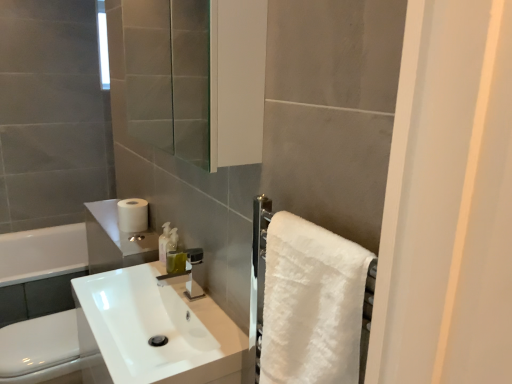
What is the approximate width of translucent plastic soap dispenser at center?

It is 6.31 centimeters.

What do you see at coordinates (41, 349) in the screenshot? This screenshot has width=512, height=384. I see `white glossy toilet bowl at lower left` at bounding box center [41, 349].

The width and height of the screenshot is (512, 384). In order to click on translucent plastic soap dispenser at center in this screenshot , I will do `click(172, 240)`.

Where is `white glossy sink at center`? Image resolution: width=512 pixels, height=384 pixels. white glossy sink at center is located at coordinates (153, 330).

From the image's perspective, does translucent plastic soap dispenser at center appear lower than white glossy toilet bowl at lower left?

Actually, translucent plastic soap dispenser at center appears above white glossy toilet bowl at lower left in the image.

Is translucent plastic soap dispenser at center not close to white glossy toilet bowl at lower left?

No, there isn't a large distance between translucent plastic soap dispenser at center and white glossy toilet bowl at lower left.

Which is behind, point (175, 246) or point (60, 375)?

Point (175, 246)

Does translucent plastic soap dispenser at center have a larger size compared to white glossy toilet bowl at lower left?

No, translucent plastic soap dispenser at center is not bigger than white glossy toilet bowl at lower left.

Is the surface of translucent plastic soap dispenser at center in direct contact with translucent plastic soap dispenser at center?

Yes, translucent plastic soap dispenser at center is in contact with translucent plastic soap dispenser at center.

From the image's perspective, is translucent plastic soap dispenser at center located above or below translucent plastic soap dispenser at center?

Clearly, from the image's perspective, translucent plastic soap dispenser at center is below translucent plastic soap dispenser at center.

Considering the positions of objects translucent plastic soap dispenser at center and translucent plastic soap dispenser at center in the image provided, who is behind, translucent plastic soap dispenser at center or translucent plastic soap dispenser at center?

→ translucent plastic soap dispenser at center is more distant.

Is translucent plastic soap dispenser at center shorter than translucent plastic soap dispenser at center?

Incorrect, the height of translucent plastic soap dispenser at center does not fall short of that of translucent plastic soap dispenser at center.

From a real-world perspective, is white matte toilet paper at upper left physically located above or below translucent plastic soap dispenser at center?

white matte toilet paper at upper left is above translucent plastic soap dispenser at center.

Is white matte toilet paper at upper left taller or shorter than translucent plastic soap dispenser at center?

In the image, white matte toilet paper at upper left appears to be shorter than translucent plastic soap dispenser at center.

Between white matte toilet paper at upper left and translucent plastic soap dispenser at center, which one has smaller size?

Smaller between the two is translucent plastic soap dispenser at center.

Is white matte toilet paper at upper left directly adjacent to translucent plastic soap dispenser at center?

There is a gap between white matte toilet paper at upper left and translucent plastic soap dispenser at center.

Which of these two, white matte toilet paper at upper left or translucent plastic soap dispenser at center, stands shorter?

Standing shorter between the two is white matte toilet paper at upper left.

You are a GUI agent. You are given a task and a screenshot of the screen. Output one action in this format:
    pyautogui.click(x=<x>, y=<y>)
    Task: Click on the toiletry in front of the white matte toilet paper at upper left
    
    Given the screenshot: What is the action you would take?
    tap(164, 241)

Is white matte toilet paper at upper left next to translucent plastic soap dispenser at center and touching it?

No, white matte toilet paper at upper left is not next to translucent plastic soap dispenser at center.

Would you say white glossy toilet bowl at lower left is inside or outside white matte toilet paper at upper left?

white glossy toilet bowl at lower left is not inside white matte toilet paper at upper left, it's outside.

Are white glossy toilet bowl at lower left and white matte toilet paper at upper left beside each other?

white glossy toilet bowl at lower left and white matte toilet paper at upper left are not in contact.

Measure the distance between white glossy toilet bowl at lower left and white matte toilet paper at upper left.

They are 22.18 inches apart.

Does point (62, 374) come in front of point (139, 218)?

Yes, it is.

From a real-world perspective, is translucent plastic soap dispenser at center located beneath translucent plastic soap dispenser at center?

Yes.

Which is closer, (165, 235) or (172, 244)?

The point (172, 244) is in front.

Which is behind, translucent plastic soap dispenser at center or translucent plastic soap dispenser at center?

translucent plastic soap dispenser at center.

Is there a large distance between translucent plastic soap dispenser at center and translucent plastic soap dispenser at center?

They are positioned close to each other.

Is white matte toilet paper at upper left at the back of white glossy sink at center?

No, white matte toilet paper at upper left is not at the back of white glossy sink at center.

Is white glossy sink at center to the left of white matte toilet paper at upper left from the viewer's perspective?

Incorrect, white glossy sink at center is not on the left side of white matte toilet paper at upper left.

Are white glossy sink at center and white matte toilet paper at upper left making contact?

white glossy sink at center is not next to white matte toilet paper at upper left, and they're not touching.

Is white glossy sink at center bigger than white matte toilet paper at upper left?

Indeed, white glossy sink at center has a larger size compared to white matte toilet paper at upper left.

Where is `soap dispenser above the white glossy toilet bowl at lower left (from a real-world perspective)`? Image resolution: width=512 pixels, height=384 pixels. soap dispenser above the white glossy toilet bowl at lower left (from a real-world perspective) is located at coordinates (172, 240).

Where is `soap dispenser on the right of translucent plastic soap dispenser at center`? The width and height of the screenshot is (512, 384). soap dispenser on the right of translucent plastic soap dispenser at center is located at coordinates (172, 240).

When comparing their distances from white fluffy towel at right, does translucent plastic soap dispenser at center or white glossy toilet bowl at lower left seem closer?

Among the two, translucent plastic soap dispenser at center is located nearer to white fluffy towel at right.

Estimate the real-world distances between objects in this image. Which object is further from white glossy sink at center, white fluffy towel at right or translucent plastic soap dispenser at center?

Based on the image, white fluffy towel at right appears to be further to white glossy sink at center.

Looking at the image, which one is located further to translucent plastic soap dispenser at center, white glossy sink at center or white glossy toilet bowl at lower left?

white glossy toilet bowl at lower left.

Which object lies further to the anchor point white matte toilet paper at upper left, translucent plastic soap dispenser at center or white fluffy towel at right?

white fluffy towel at right is positioned further to the anchor white matte toilet paper at upper left.

When comparing their distances from translucent plastic soap dispenser at center, does translucent plastic soap dispenser at center or white fluffy towel at right seem further?

white fluffy towel at right is further to translucent plastic soap dispenser at center.

From the image, which object appears to be nearer to white glossy sink at center, white glossy toilet bowl at lower left or white fluffy towel at right?

white glossy toilet bowl at lower left is closer to white glossy sink at center.

Considering their positions, is white glossy toilet bowl at lower left positioned further to white glossy sink at center than translucent plastic soap dispenser at center?

translucent plastic soap dispenser at center lies further to white glossy sink at center than the other object.

Looking at this image, which object lies nearer to the anchor point white fluffy towel at right, white glossy toilet bowl at lower left or translucent plastic soap dispenser at center?

Among the two, translucent plastic soap dispenser at center is located nearer to white fluffy towel at right.

Where is `toilet bowl between white glossy sink at center and white matte toilet paper at upper left along the z-axis`? This screenshot has height=384, width=512. toilet bowl between white glossy sink at center and white matte toilet paper at upper left along the z-axis is located at coordinates (41, 349).

Image resolution: width=512 pixels, height=384 pixels. Find the location of `soap dispenser between white glossy sink at center and white matte toilet paper at upper left from front to back`. soap dispenser between white glossy sink at center and white matte toilet paper at upper left from front to back is located at coordinates (172, 240).

I want to click on toilet bowl between white fluffy towel at right and white matte toilet paper at upper left in the front-back direction, so click(x=41, y=349).

Find the location of a particular element. sink between white fluffy towel at right and white matte toilet paper at upper left along the z-axis is located at coordinates (153, 330).